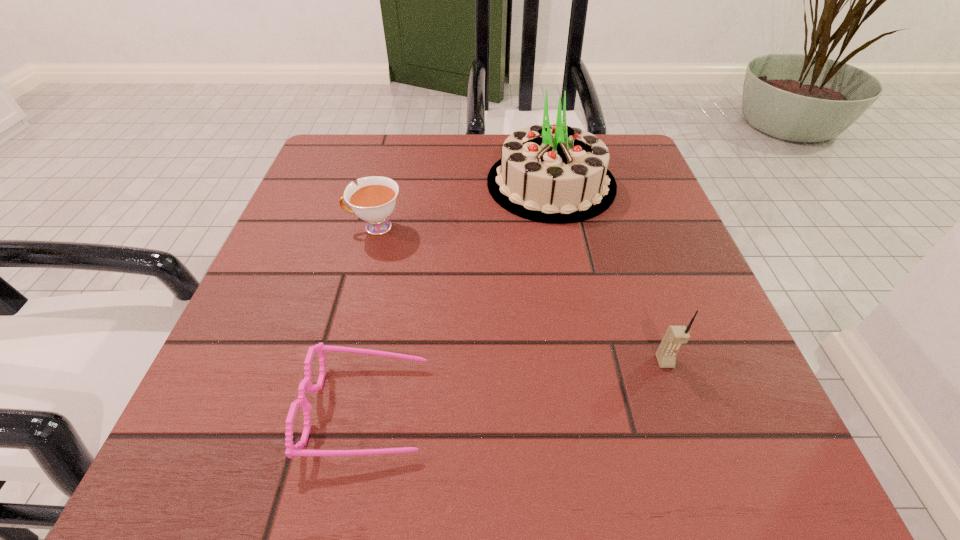
What are the coordinates of `teacup that is at the left edge` in the screenshot? It's located at (373, 200).

Where is `spectacles located in the left edge section of the desktop`? This screenshot has height=540, width=960. spectacles located in the left edge section of the desktop is located at coordinates (292, 450).

Locate an element on the screen. Image resolution: width=960 pixels, height=540 pixels. birthday cake at the right edge is located at coordinates (552, 173).

I want to click on cellular telephone that is at the right edge, so click(x=675, y=336).

The width and height of the screenshot is (960, 540). Identify the location of object at the near left corner. (292, 450).

Identify the location of object that is at the far right corner. The image size is (960, 540). (552, 173).

In the image, there is a desktop. At what (x,y) coordinates should I click in order to perform the action: click on free space at the near edge. Please return your answer as a coordinate pair (x, y). Looking at the image, I should click on (516, 440).

You are a GUI agent. You are given a task and a screenshot of the screen. Output one action in this format:
    pyautogui.click(x=<x>, y=<y>)
    Task: Click on the vacant space at the left edge of the desktop
    The width and height of the screenshot is (960, 540).
    Given the screenshot: What is the action you would take?
    pyautogui.click(x=299, y=197)

Locate an element on the screen. free space at the right edge is located at coordinates (740, 392).

At what (x,y) coordinates should I click in order to perform the action: click on free space at the far left corner of the desktop. Please return your answer as a coordinate pair (x, y). Looking at the image, I should click on (321, 158).